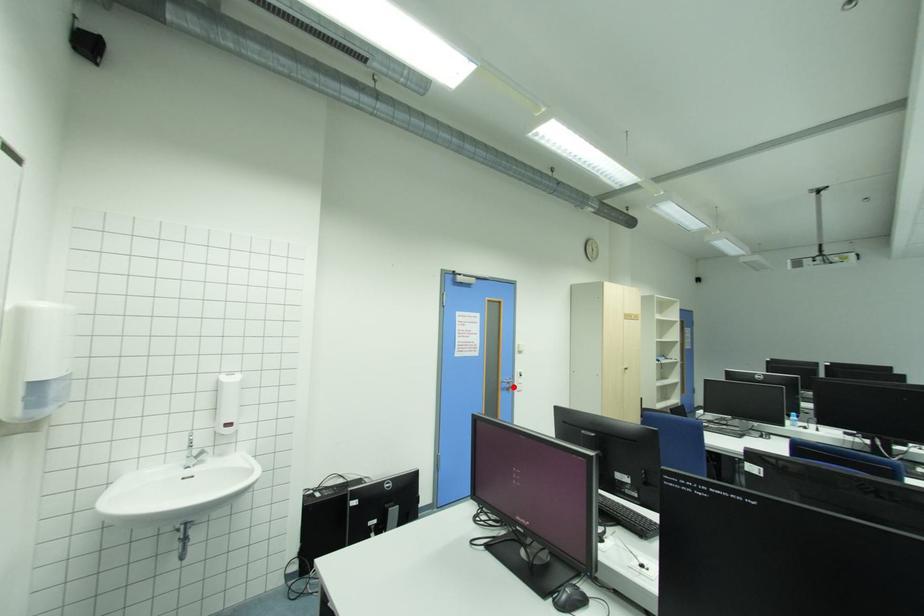
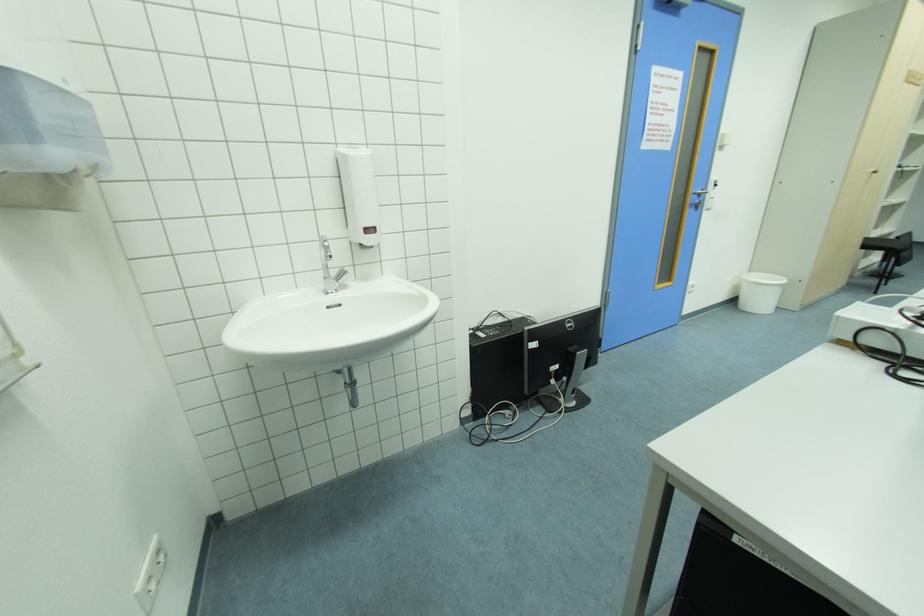
Question: I am providing you with two images of the same scene from different viewpoints. A red point is marked on the first image. Can you still see the location of the red point in image 2?

Choices:
 (A) Yes
 (B) No

Answer: (A)